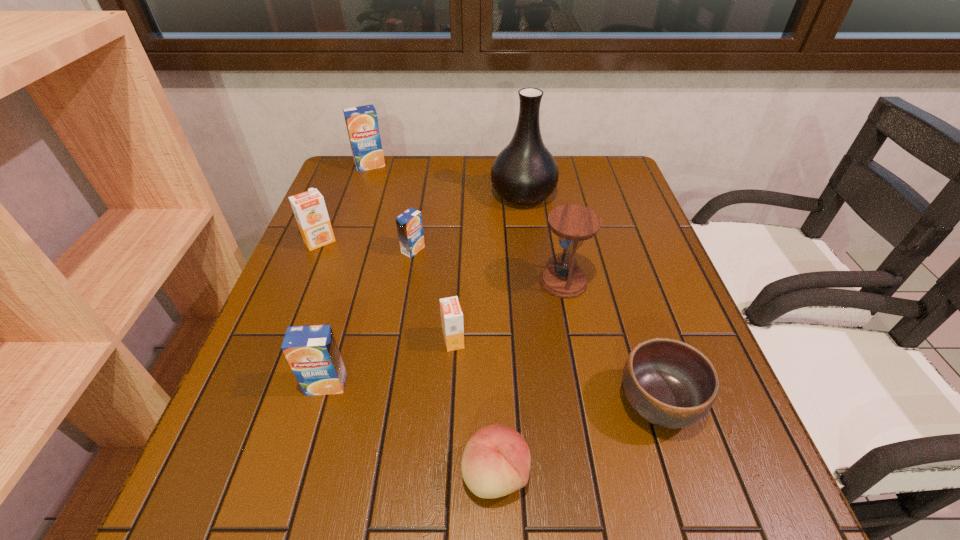
Where is `the second farthest blue orange_juice`? the second farthest blue orange_juice is located at coordinates (409, 224).

This screenshot has height=540, width=960. I want to click on the right orange orange juice, so click(451, 314).

What are the coordinates of `the sixth farthest object` in the screenshot? It's located at (451, 314).

Where is `bowl`? The height and width of the screenshot is (540, 960). bowl is located at coordinates (669, 383).

Locate an element on the screen. This screenshot has height=540, width=960. peach is located at coordinates (496, 460).

Where is `free space located on the left of the vase`? Image resolution: width=960 pixels, height=540 pixels. free space located on the left of the vase is located at coordinates (443, 194).

The width and height of the screenshot is (960, 540). What are the coordinates of `free space located 0.240m on the front of the farthest blue orange_juice` in the screenshot? It's located at (351, 218).

This screenshot has width=960, height=540. What are the coordinates of `vacant position located 0.070m on the right of the fifth nearest object` in the screenshot? It's located at (617, 282).

This screenshot has width=960, height=540. Identify the location of vacant area situated on the right of the nearest orange juice. (468, 384).

Image resolution: width=960 pixels, height=540 pixels. Find the location of `vacant space located on the front of the bigger orange orange juice`. vacant space located on the front of the bigger orange orange juice is located at coordinates (282, 333).